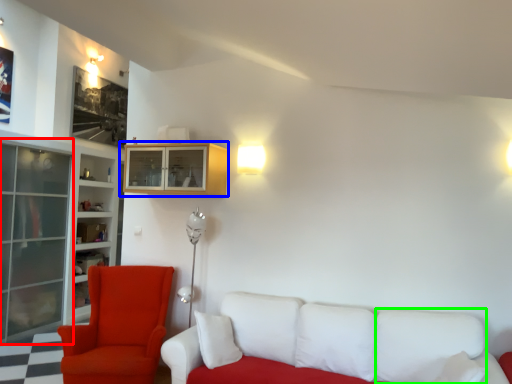
Question: Estimate the real-world distances between objects in this image. Which object is closer to glass door (highlighted by a red box), cabinetry (highlighted by a blue box) or pillow (highlighted by a green box)?

Choices:
 (A) cabinetry
 (B) pillow

Answer: (A)